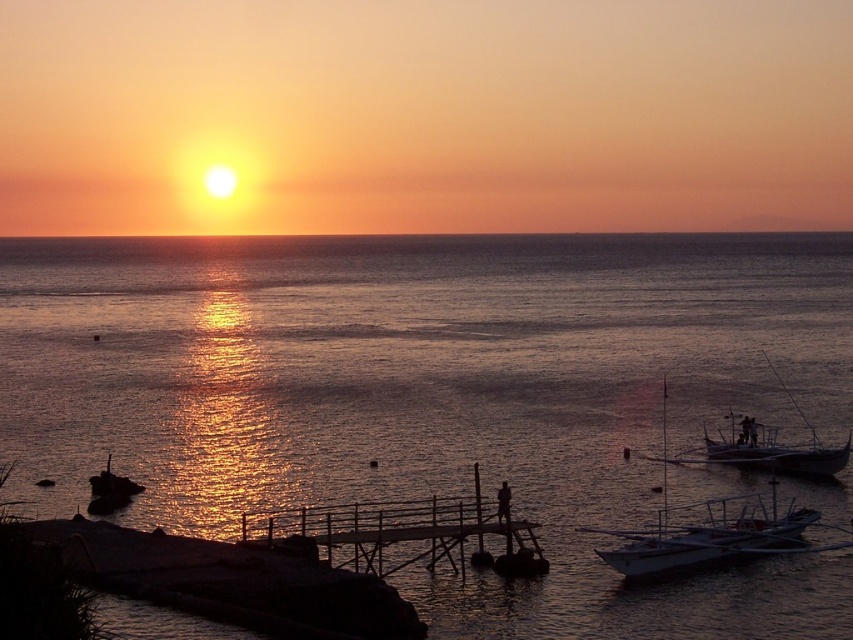
Question: Can you confirm if white matte boat at lower right is bigger than white glossy boat at lower right?

Choices:
 (A) no
 (B) yes

Answer: (B)

Question: Can you confirm if glistening water at center is smaller than white matte boat at lower right?

Choices:
 (A) no
 (B) yes

Answer: (A)

Question: Which is nearer to the white glossy boat at lower right?

Choices:
 (A) glistening water at center
 (B) white matte boat at lower right

Answer: (B)

Question: Can you confirm if wooden dock at center is thinner than white glossy boat at lower right?

Choices:
 (A) no
 (B) yes

Answer: (B)

Question: Which object is the farthest from the wooden dock at center?

Choices:
 (A) white glossy boat at lower right
 (B) glistening water at center

Answer: (B)

Question: Among these objects, which one is nearest to the camera?

Choices:
 (A) glistening water at center
 (B) white glossy boat at lower right
 (C) wooden dock at center

Answer: (A)